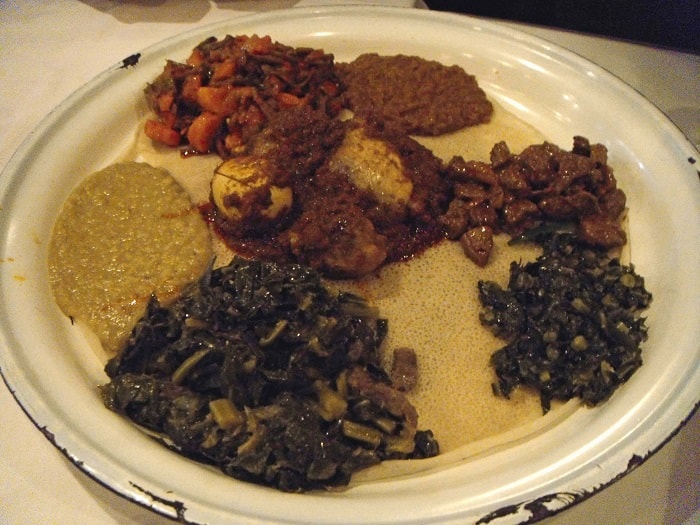
This screenshot has width=700, height=525. I want to click on table, so click(x=46, y=57), click(x=20, y=469), click(x=665, y=499), click(x=672, y=83).